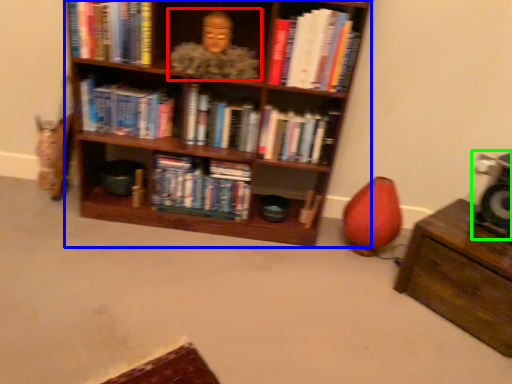
Question: Estimate the real-world distances between objects in this image. Which object is farther from person (highlighted by a red box), shelf (highlighted by a blue box) or speaker (highlighted by a green box)?

Choices:
 (A) shelf
 (B) speaker

Answer: (B)